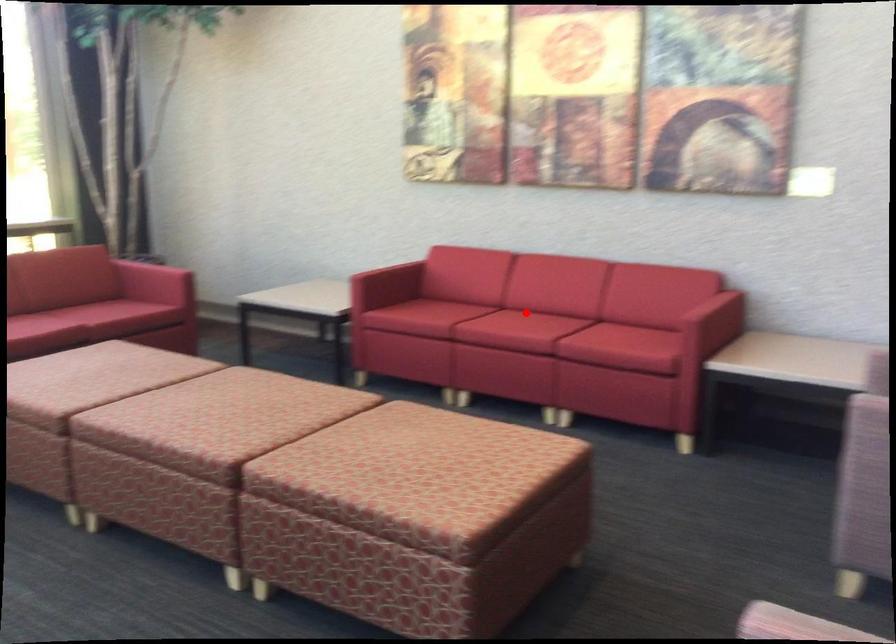
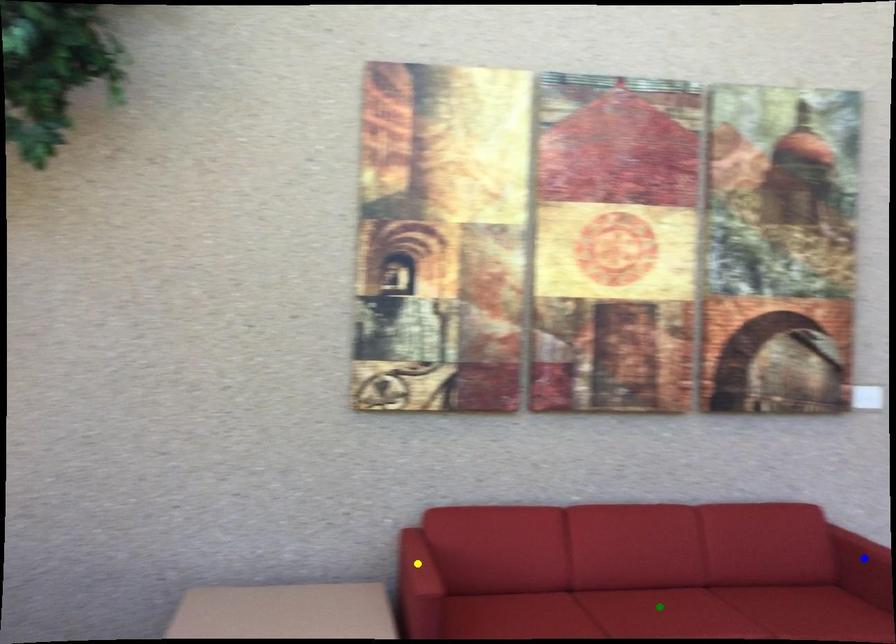
Question: I am providing you with two images of the same scene from different viewpoints. A red point is marked on the first image. You are given multiple points on the second image. Can you choose the point in image 2 that corresponds to the point in image 1?

Choices:
 (A) blue point
 (B) green point
 (C) yellow point

Answer: (B)